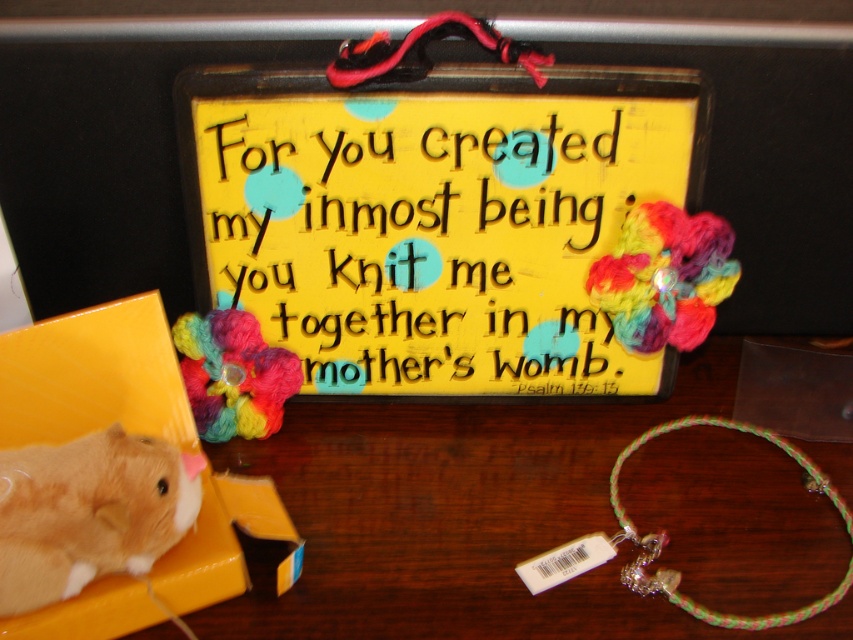
Is fluffy orange mouse at lower left above multicolored yarn flower at upper right?

No.

Who is taller, fluffy orange mouse at lower left or multicolored yarn flower at upper right?

multicolored yarn flower at upper right

Who is more forward, (190, 500) or (733, 232)?

Point (190, 500)

Where is `fluffy orange mouse at lower left`? This screenshot has height=640, width=853. fluffy orange mouse at lower left is located at coordinates (90, 513).

Who is taller, fluffy orange mouse at lower left or multicolored yarn flower at left?

fluffy orange mouse at lower left

Between fluffy orange mouse at lower left and multicolored yarn flower at left, which one appears on the left side from the viewer's perspective?

fluffy orange mouse at lower left is more to the left.

The height and width of the screenshot is (640, 853). Describe the element at coordinates (90, 513) in the screenshot. I see `fluffy orange mouse at lower left` at that location.

You are a GUI agent. You are given a task and a screenshot of the screen. Output one action in this format:
    pyautogui.click(x=<x>, y=<y>)
    Task: Click on the fluffy orange mouse at lower left
    
    Given the screenshot: What is the action you would take?
    pyautogui.click(x=90, y=513)

Looking at this image, which is above, fluffy orange mouse at lower left or multicolored braided bracelet at lower right?

fluffy orange mouse at lower left is above.

The width and height of the screenshot is (853, 640). What do you see at coordinates (90, 513) in the screenshot? I see `fluffy orange mouse at lower left` at bounding box center [90, 513].

This screenshot has height=640, width=853. In order to click on fluffy orange mouse at lower left in this screenshot , I will do `click(90, 513)`.